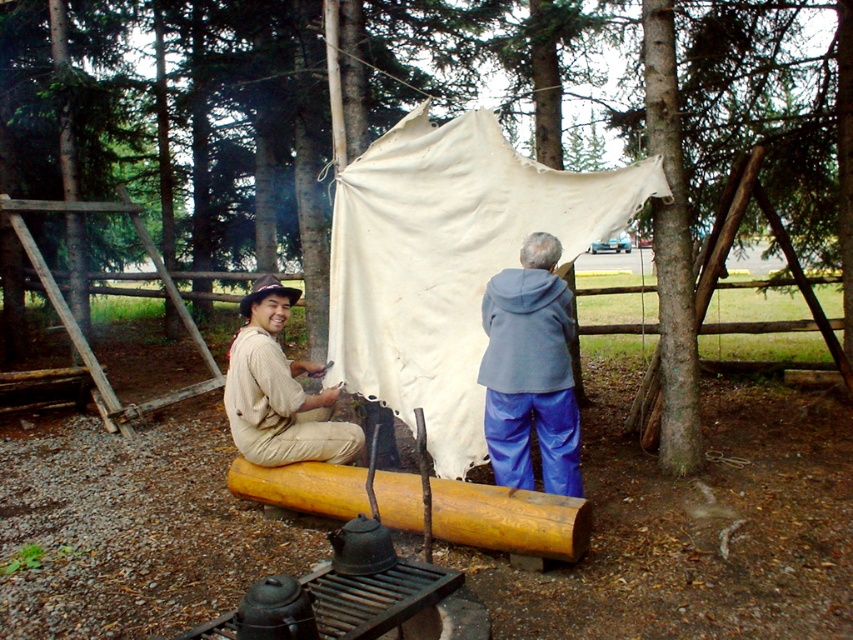
Question: Which point is closer to the camera?

Choices:
 (A) (550, 346)
 (B) (527, 314)
 (C) (405, 513)

Answer: (C)

Question: Which point appears farthest from the camera in this image?

Choices:
 (A) (450, 156)
 (B) (505, 413)
 (C) (263, 289)
 (D) (479, 372)

Answer: (A)

Question: Does white canvas tent at center have a greater width compared to yellow wood log at center?

Choices:
 (A) yes
 (B) no

Answer: (A)

Question: Can you confirm if yellow wood log at center is thinner than beige cotton shirt at center?

Choices:
 (A) no
 (B) yes

Answer: (A)

Question: Among these objects, which one is farthest from the camera?

Choices:
 (A) beige cotton shirt at center
 (B) yellow wood log at center

Answer: (A)

Question: Is white canvas tent at center to the left of beige corduroy pants at center from the viewer's perspective?

Choices:
 (A) no
 (B) yes

Answer: (B)